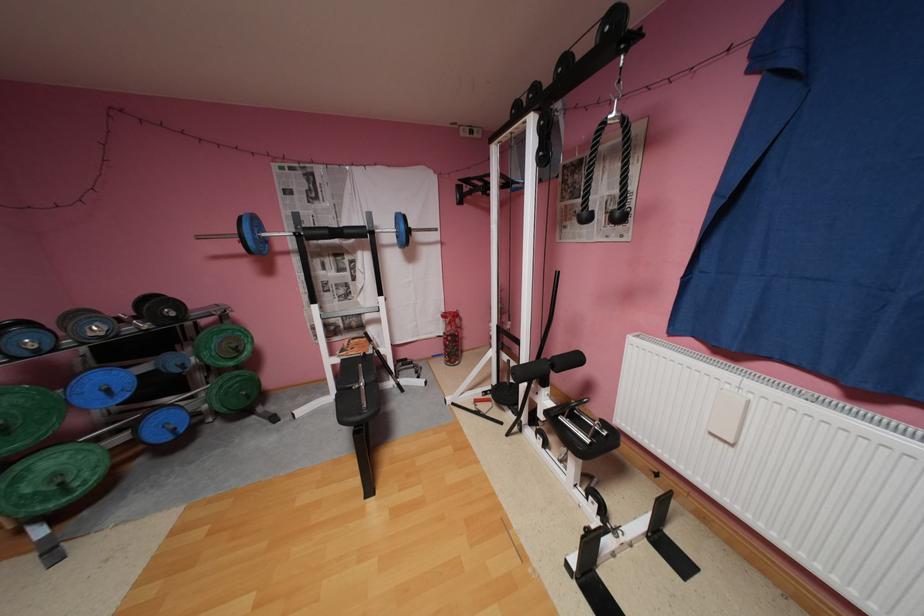
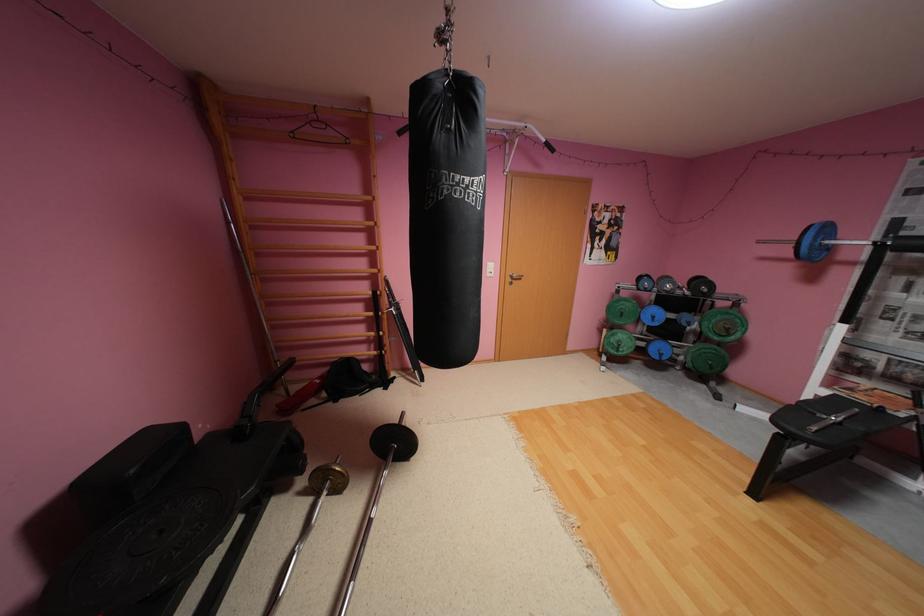
Find the pixel in the second image that matches point (181, 314) in the first image.

(714, 291)